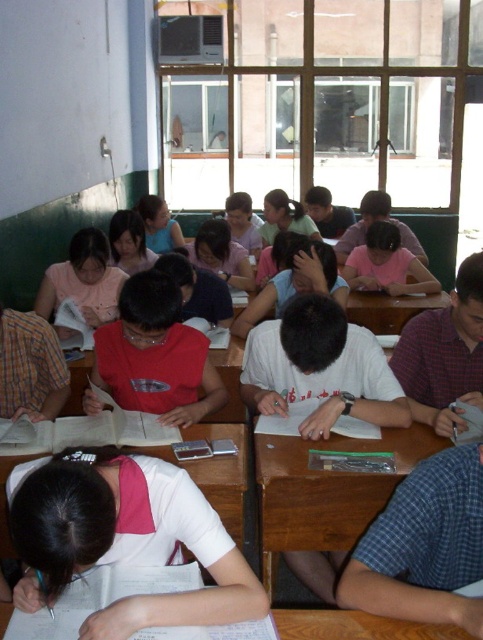
Question: Is white matte shirt at center positioned before wooden desk at center?

Choices:
 (A) yes
 (B) no

Answer: (A)

Question: Is white matte shirt at center smaller than wooden desk at center?

Choices:
 (A) yes
 (B) no

Answer: (A)

Question: Among these objects, which one is nearest to the camera?

Choices:
 (A) wooden desk at center
 (B) white matte shirt at center

Answer: (B)

Question: Can you confirm if white matte shirt at center is thinner than wooden desk at center?

Choices:
 (A) no
 (B) yes

Answer: (B)